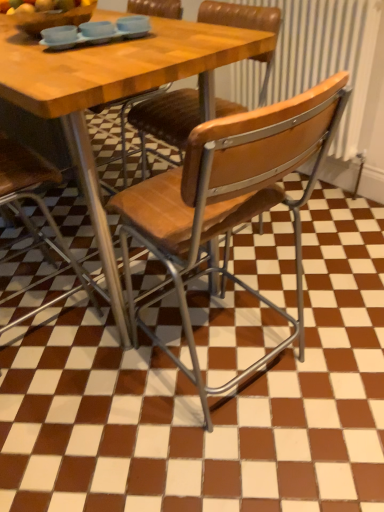
Locate an element on the screen. The height and width of the screenshot is (512, 384). free space in front of wooden seat at center, positioned as the 1th chair in left-to-right order is located at coordinates (57, 391).